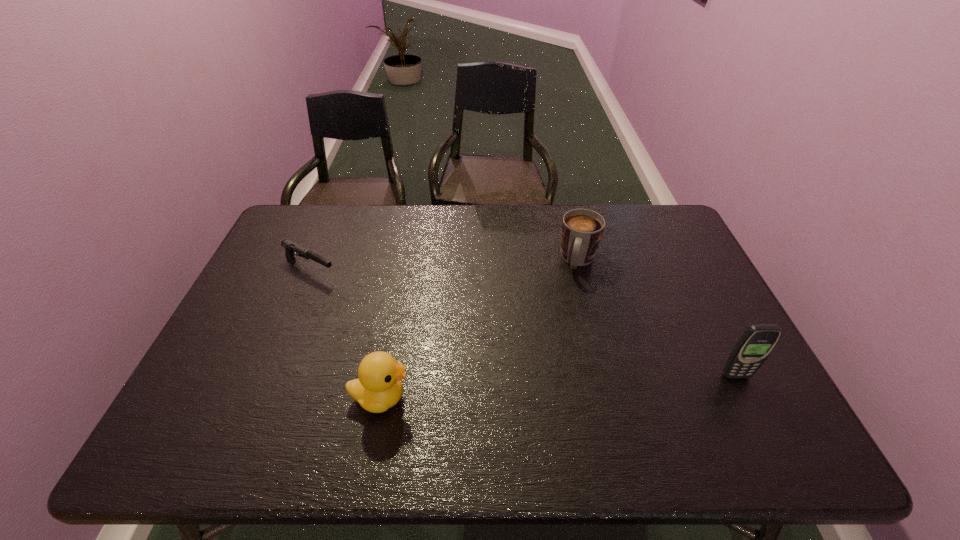
Identify the location of free space on the desktop that is between the duck and the rightmost object and is positioned on the side of the mug with the handle. This screenshot has height=540, width=960. (544, 388).

In order to click on vacant spot on the desktop that is between the duck and the tallest object and is positioned at the muzzle end of the leftmost object in this screenshot , I will do `click(535, 388)`.